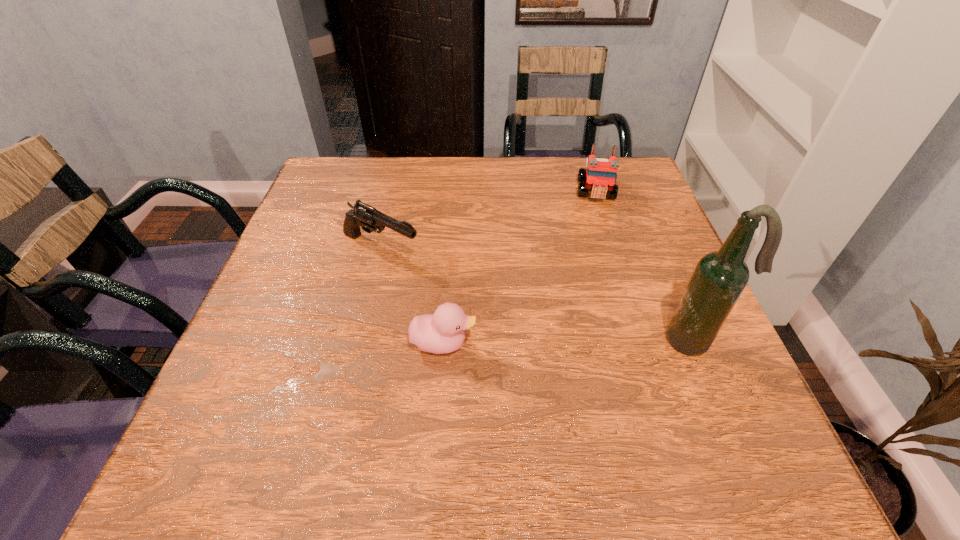
Identify which object is the second nearest to the duckling. Please provide its 2D coordinates. Your answer should be formatted as a tuple, i.e. [(x, y)], where the tuple contains the x and y coordinates of a point satisfying the conditions above.

[(719, 278)]

Identify which object is the second closest to the beer bottle. Please provide its 2D coordinates. Your answer should be formatted as a tuple, i.e. [(x, y)], where the tuple contains the x and y coordinates of a point satisfying the conditions above.

[(599, 177)]

Where is `vacant region that satisfies the following two spatial constraints: 1. on the back side of the Lego; 2. on the right side of the second farthest object`? vacant region that satisfies the following two spatial constraints: 1. on the back side of the Lego; 2. on the right side of the second farthest object is located at coordinates (395, 191).

Locate an element on the screen. Image resolution: width=960 pixels, height=540 pixels. free space that satisfies the following two spatial constraints: 1. on the front side of the tallest object; 2. on the left side of the gun is located at coordinates (359, 340).

The width and height of the screenshot is (960, 540). I want to click on free location that satisfies the following two spatial constraints: 1. on the front side of the second farthest object; 2. on the front-facing side of the duckling, so click(x=358, y=343).